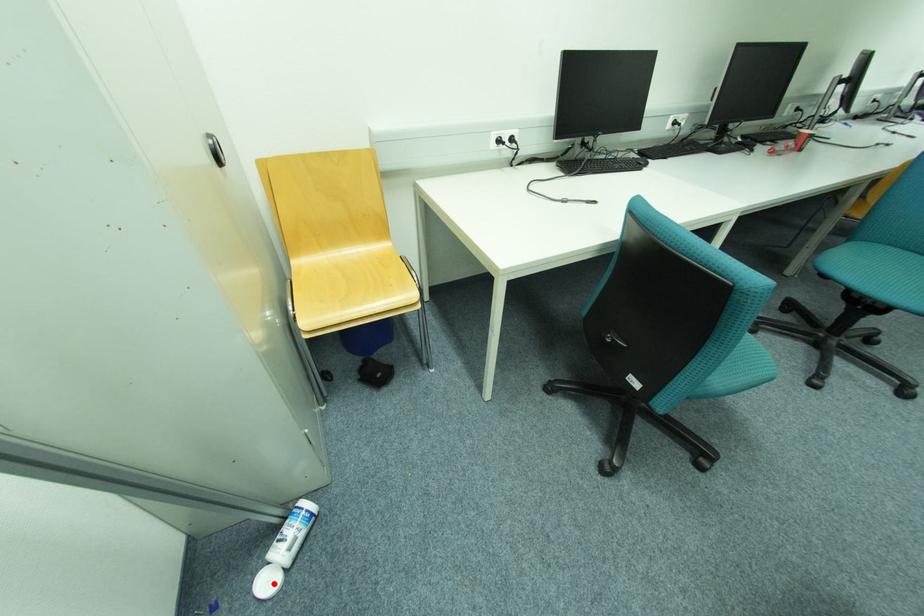
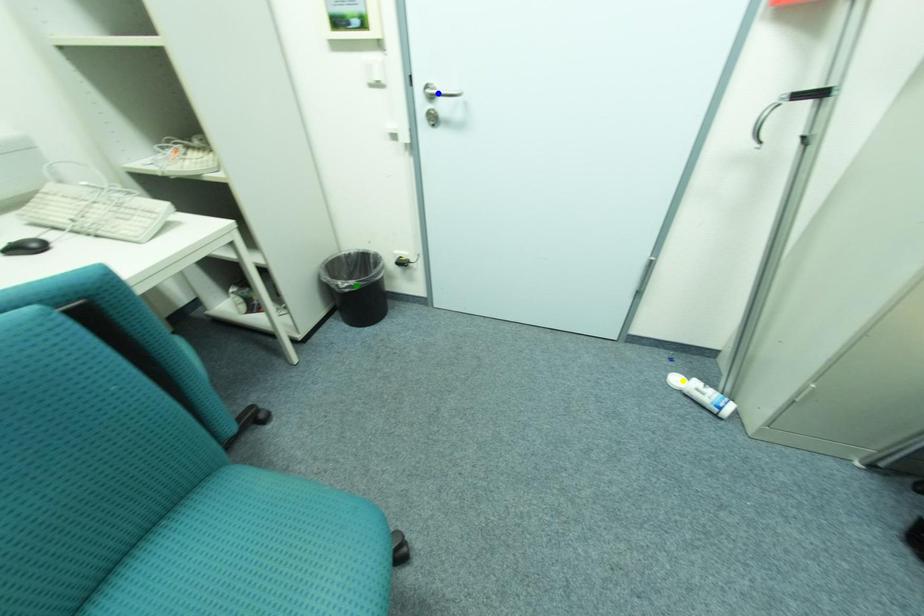
Question: I am providing you with two images of the same scene from different viewpoints. A red point is marked on the first image. You are given multiple points on the second image. Which point in image 2 represents the same 3d spot as the red point in image 1?

Choices:
 (A) green point
 (B) yellow point
 (C) blue point

Answer: (B)